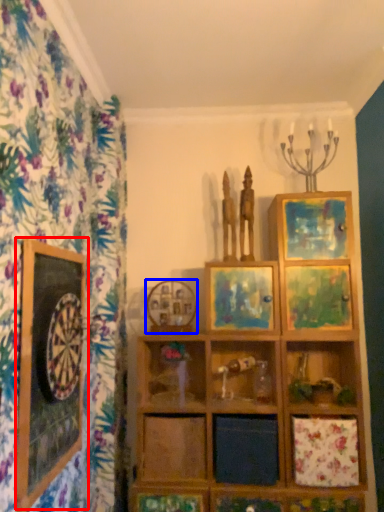
Question: Which object appears farthest to the camera in this image, picture frame (highlighted by a red box) or picture frame (highlighted by a blue box)?

Choices:
 (A) picture frame
 (B) picture frame

Answer: (B)